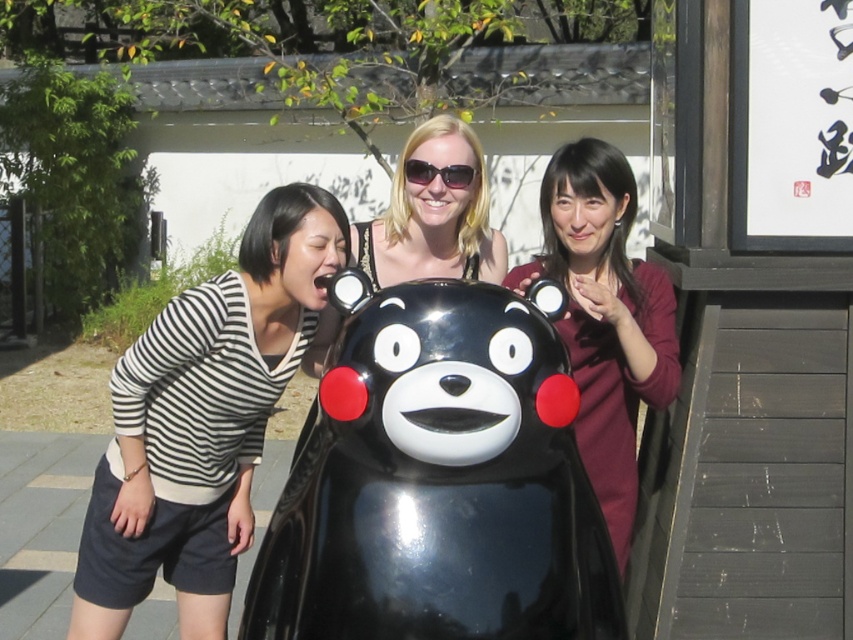
You are standing at the point with coordinates point (424, 321) and want to walk to the point with coordinates point (151, 349). Which direction should you move in to reach your destination?

To reach point (151, 349) from point (424, 321), you should move downward because point (151, 349) is below point (424, 321).

What is located at the coordinate point (x=202, y=420) in the image?

The striped fabric shirt at left is located at the coordinate point (x=202, y=420).

You are standing in front of the glossy black bear at center and the maroon sweater at right. Which object is closer to your left side?

The glossy black bear at center is positioned on the left side of maroon sweater at right, so it is closer to your left side.